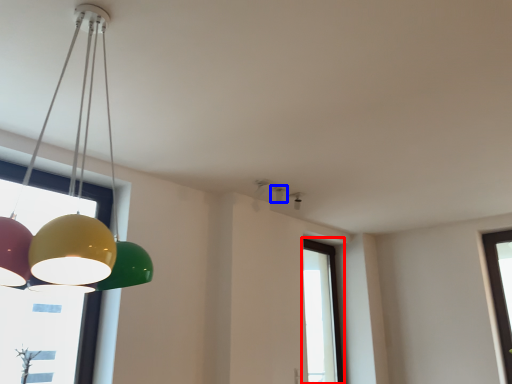
Question: Among these objects, which one is farthest to the camera, window (highlighted by a red box) or lamp (highlighted by a blue box)?

Choices:
 (A) window
 (B) lamp

Answer: (A)